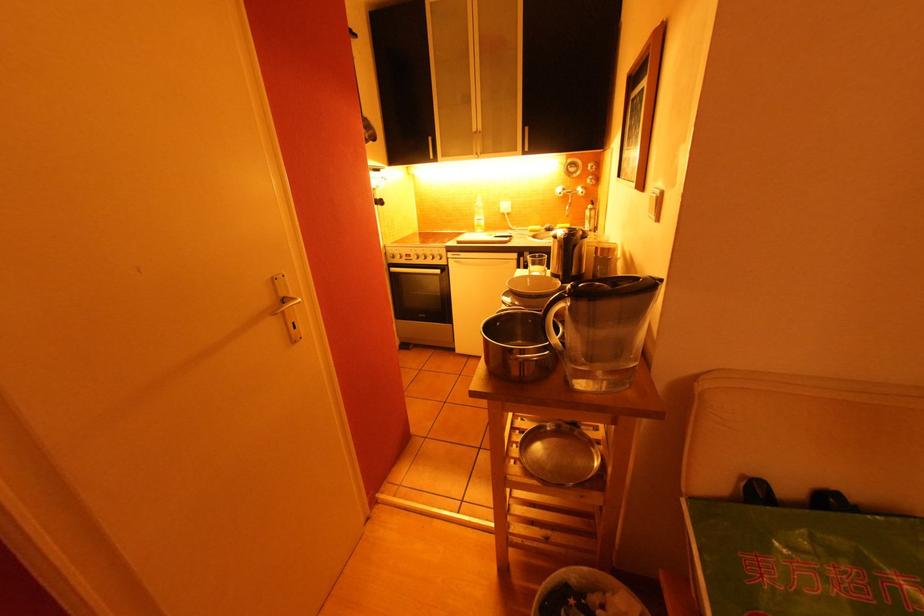
Find the location of `white door handle`. white door handle is located at coordinates (286, 307).